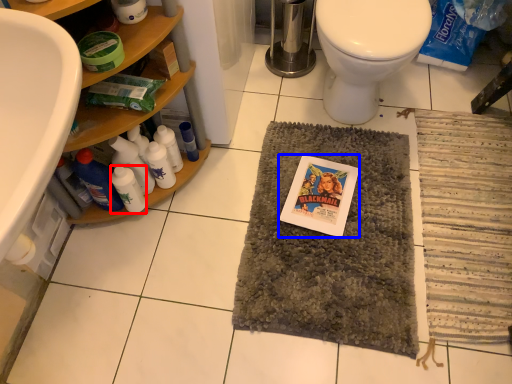
Question: Which point is closer to the camera, bottle (highlighted by a red box) or comic book (highlighted by a blue box)?

Choices:
 (A) bottle
 (B) comic book

Answer: (A)